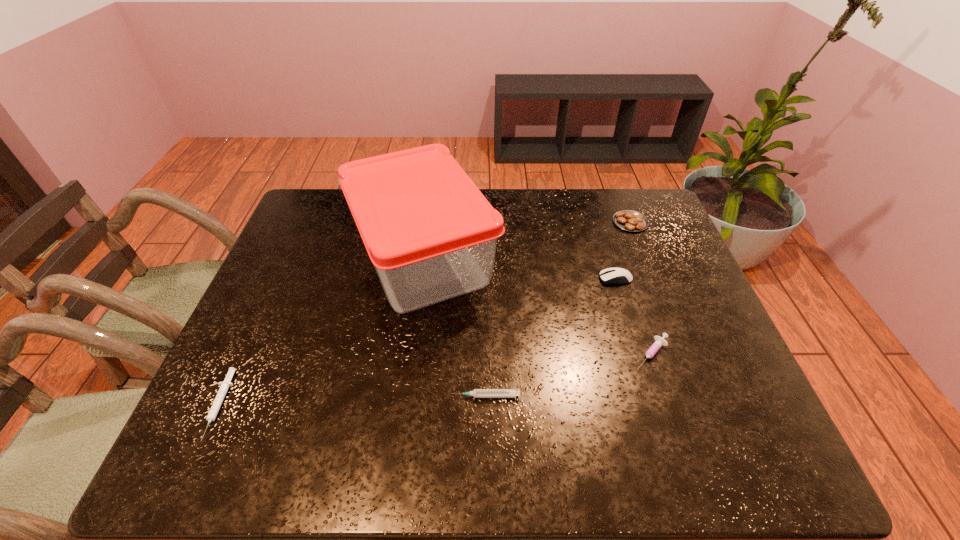
Image resolution: width=960 pixels, height=540 pixels. I want to click on tray, so click(431, 235).

You are a GUI agent. You are given a task and a screenshot of the screen. Output one action in this format:
    pyautogui.click(x=<x>, y=<y>)
    Task: Click on the mouse
    The image size is (960, 540).
    Given the screenshot: What is the action you would take?
    pyautogui.click(x=610, y=275)

Locate an element on the screen. The image size is (960, 540). pastry is located at coordinates (628, 220).

This screenshot has height=540, width=960. What are the coordinates of `the rightmost syringe` in the screenshot? It's located at (660, 341).

Locate an element on the screen. The image size is (960, 540). the second syringe from left to right is located at coordinates (477, 393).

Identify the location of the leftmost object. (224, 386).

Find the location of `the shortest syringe`. the shortest syringe is located at coordinates (224, 386).

You are a GUI agent. You are given a task and a screenshot of the screen. Output one action in this format:
    pyautogui.click(x=<x>, y=<y>)
    Task: Click on the free space located 0.080m on the back of the tray
    This screenshot has width=960, height=540.
    Given the screenshot: What is the action you would take?
    pyautogui.click(x=432, y=192)

The height and width of the screenshot is (540, 960). What are the coordinates of `blank area located 0.050m on the right of the mouse` in the screenshot? It's located at (650, 279).

In order to click on vacant space located 0.190m on the front of the pastry in this screenshot , I will do (x=651, y=276).